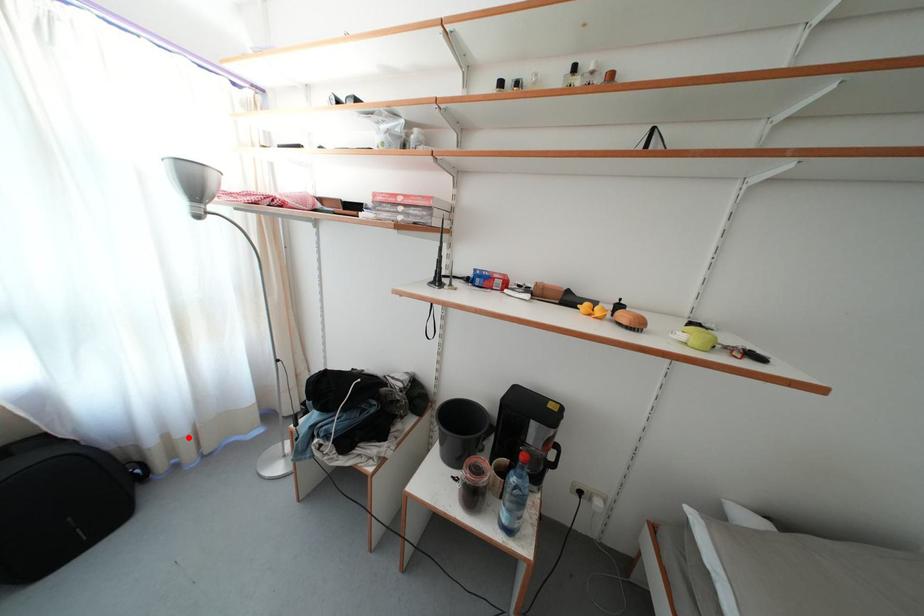
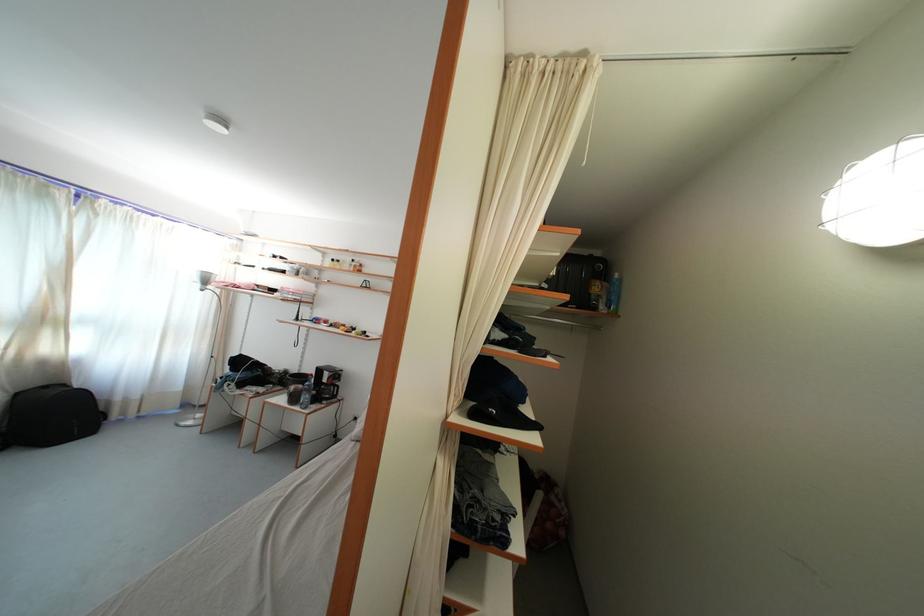
Question: I am providing you with two images of the same scene from different viewpoints. A red point is marked on the first image. At the location where the point appears in image 1, is it still visible in image 2?

Choices:
 (A) Yes
 (B) No

Answer: (A)